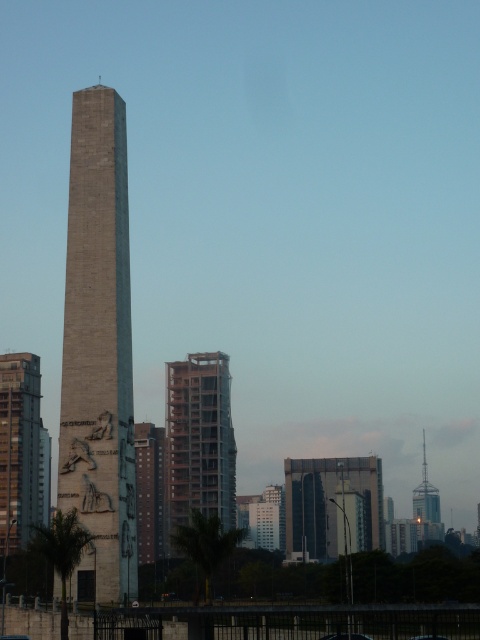
You are standing in the city square and see the gray stone obelisk at center and the smooth concrete building at center. Which object is nearer to you?

The gray stone obelisk at center is closer to the viewer than the smooth concrete building at center.

In the scene shown: You are a drone operator who needs to fly a drone from the gray stone obelisk at center to the dark glass building at center. The drone has a maximum flight range of 150 meters. Can the drone complete the journey without needing to recharge?

The distance between the gray stone obelisk at center and the dark glass building at center is 134.64 meters, which is within the drone operator s 150 meter range. The drone can complete the journey without needing to recharge.

You are standing in front of the obelisk structure and want to take a photo of the point at coordinate (x=23, y=358). If your camera has a maximum range of 200 meters, will you be able to capture that point in your photo?

The point at coordinate (x=23, y=358) is 218.49 meters away from the camera, which exceeds the camera maximum range of 200 meters. Therefore, you cannot capture that point in your photo.